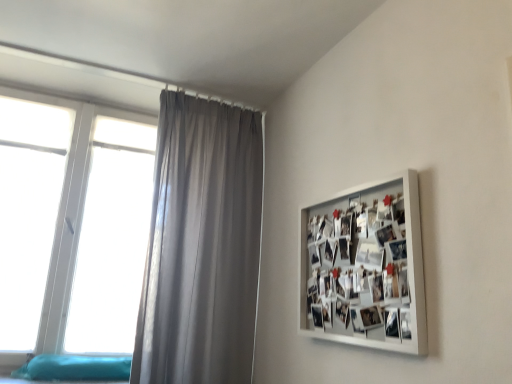
What do you see at coordinates (365, 267) in the screenshot? Image resolution: width=512 pixels, height=384 pixels. I see `white matte picture frame at upper right` at bounding box center [365, 267].

This screenshot has height=384, width=512. I want to click on white plastic window at left, so click(x=71, y=224).

What do you see at coordinates (71, 224) in the screenshot?
I see `white plastic window at left` at bounding box center [71, 224].

You are a GUI agent. You are given a task and a screenshot of the screen. Output one action in this format:
    pyautogui.click(x=<x>, y=<y>)
    Task: Click on the teal fabric bed at lower left
    Image resolution: width=512 pixels, height=384 pixels.
    Given the screenshot: What is the action you would take?
    pyautogui.click(x=75, y=368)

Would you consider teal fabric bed at lower left to be distant from white plastic window at left?

teal fabric bed at lower left is near white plastic window at left, not far away.

Can you confirm if teal fabric bed at lower left is shorter than white plastic window at left?

Indeed, teal fabric bed at lower left has a lesser height compared to white plastic window at left.

Which is more to the left, teal fabric bed at lower left or white plastic window at left?

white plastic window at left.

Is the position of teal fabric bed at lower left less distant than that of white plastic window at left?

Yes, it is.

Does white matte picture frame at upper right come behind white plastic window at left?

No, white matte picture frame at upper right is closer to the viewer.

Is white matte picture frame at upper right positioned far away from white plastic window at left?

Yes, white matte picture frame at upper right and white plastic window at left are quite far apart.

Based on the photo, is white matte picture frame at upper right inside or outside of white plastic window at left?

white matte picture frame at upper right is outside white plastic window at left.

At what (x,y) coordinates should I click in order to perform the action: click on window lying behind the white matte picture frame at upper right. Please return your answer as a coordinate pair (x, y). Looking at the image, I should click on pyautogui.click(x=71, y=224).

Is point (423, 346) closer or farther from the camera than point (30, 367)?

Point (423, 346) appears to be closer to the viewer than point (30, 367).

Which object is thinner, white matte picture frame at upper right or teal fabric bed at lower left?

white matte picture frame at upper right.

Is white matte picture frame at upper right with teal fabric bed at lower left?

white matte picture frame at upper right and teal fabric bed at lower left are not in contact.

Which of these two, white matte picture frame at upper right or teal fabric bed at lower left, stands shorter?

teal fabric bed at lower left is shorter.

Is white plastic window at left next to white matte picture frame at upper right?

No, white plastic window at left is not touching white matte picture frame at upper right.

Considering the sizes of objects white plastic window at left and white matte picture frame at upper right in the image provided, who is thinner, white plastic window at left or white matte picture frame at upper right?

With smaller width is white matte picture frame at upper right.

Where is `window above the white matte picture frame at upper right (from the image's perspective)`? This screenshot has height=384, width=512. window above the white matte picture frame at upper right (from the image's perspective) is located at coordinates (71, 224).

Is teal fabric bed at lower left oriented towards satin gray curtain at upper left?

No, teal fabric bed at lower left is not facing towards satin gray curtain at upper left.

In the image, is teal fabric bed at lower left positioned in front of or behind satin gray curtain at upper left?

teal fabric bed at lower left is positioned farther from the viewer than satin gray curtain at upper left.

In the scene shown: Which of these two, teal fabric bed at lower left or satin gray curtain at upper left, stands taller?

satin gray curtain at upper left is taller.

Who is smaller, teal fabric bed at lower left or satin gray curtain at upper left?

teal fabric bed at lower left.

From a real-world perspective, which object stands above the other?

white matte picture frame at upper right, from a real-world perspective.

Considering the relative sizes of teal fabric bed at lower left and white matte picture frame at upper right in the image provided, is teal fabric bed at lower left thinner than white matte picture frame at upper right?

No, teal fabric bed at lower left is not thinner than white matte picture frame at upper right.

Does point (68, 371) appear closer or farther from the camera than point (302, 262)?

Point (68, 371) is positioned farther from the camera compared to point (302, 262).

This screenshot has width=512, height=384. Identify the location of picture frame that appears in front of the satin gray curtain at upper left. (365, 267).

Is satin gray curtain at upper left facing away from white matte picture frame at upper right?

No, satin gray curtain at upper left is not facing the opposite direction of white matte picture frame at upper right.

Is satin gray curtain at upper left positioned far away from white matte picture frame at upper right?

Actually, satin gray curtain at upper left and white matte picture frame at upper right are a little close together.

Considering the sizes of objects satin gray curtain at upper left and white matte picture frame at upper right in the image provided, who is taller, satin gray curtain at upper left or white matte picture frame at upper right?

satin gray curtain at upper left.

This screenshot has height=384, width=512. In order to click on bed frame below the white plastic window at left (from the image's perspective) in this screenshot , I will do `click(75, 368)`.

Where is `picture frame in front of the white plastic window at left`? The height and width of the screenshot is (384, 512). picture frame in front of the white plastic window at left is located at coordinates (365, 267).

Based on their spatial positions, is teal fabric bed at lower left or satin gray curtain at upper left further from white plastic window at left?

teal fabric bed at lower left lies further to white plastic window at left than the other object.

Looking at the image, which one is located closer to satin gray curtain at upper left, white matte picture frame at upper right or white plastic window at left?

white plastic window at left is positioned closer to the anchor satin gray curtain at upper left.

Which object lies nearer to the anchor point white plastic window at left, white matte picture frame at upper right or satin gray curtain at upper left?

The object closer to white plastic window at left is satin gray curtain at upper left.

Which object lies further to the anchor point teal fabric bed at lower left, satin gray curtain at upper left or white matte picture frame at upper right?

Among the two, white matte picture frame at upper right is located further to teal fabric bed at lower left.

Looking at the image, which one is located closer to teal fabric bed at lower left, white plastic window at left or satin gray curtain at upper left?

satin gray curtain at upper left lies closer to teal fabric bed at lower left than the other object.

When comparing their distances from satin gray curtain at upper left, does white plastic window at left or white matte picture frame at upper right seem closer?

white plastic window at left lies closer to satin gray curtain at upper left than the other object.

Based on their spatial positions, is teal fabric bed at lower left or white plastic window at left closer to white matte picture frame at upper right?

teal fabric bed at lower left lies closer to white matte picture frame at upper right than the other object.

Which object lies further to the anchor point white matte picture frame at upper right, white plastic window at left or satin gray curtain at upper left?

white plastic window at left is further to white matte picture frame at upper right.

The width and height of the screenshot is (512, 384). What are the coordinates of `bed frame located between white plastic window at left and white matte picture frame at upper right in the left-right direction` in the screenshot? It's located at (75, 368).

The image size is (512, 384). What are the coordinates of `curtain between teal fabric bed at lower left and white matte picture frame at upper right` in the screenshot? It's located at (202, 246).

Locate an element on the screen. bed frame between white plastic window at left and satin gray curtain at upper left in the horizontal direction is located at coordinates (75, 368).

Where is `curtain between white plastic window at left and white matte picture frame at upper right`? This screenshot has width=512, height=384. curtain between white plastic window at left and white matte picture frame at upper right is located at coordinates (202, 246).